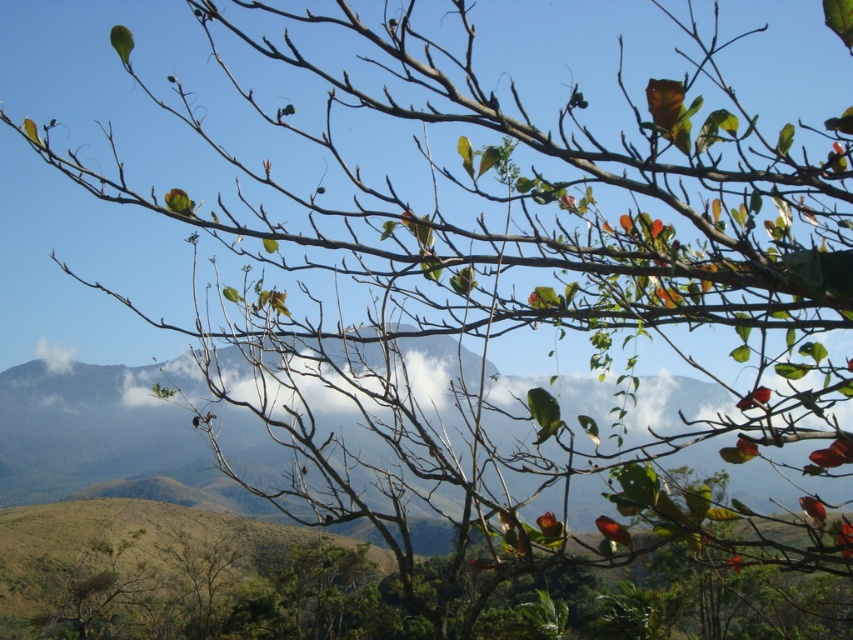
Between white fluffy cloud at center and green matte parrot at upper left, which one appears on the right side from the viewer's perspective?

Positioned to the right is green matte parrot at upper left.

Is point (341, 353) farther from camera compared to point (183, 189)?

No, it is not.

Describe the element at coordinates (354, 364) in the screenshot. I see `white fluffy cloud at center` at that location.

Locate an element on the screen. Image resolution: width=853 pixels, height=640 pixels. white fluffy cloud at center is located at coordinates (x=354, y=364).